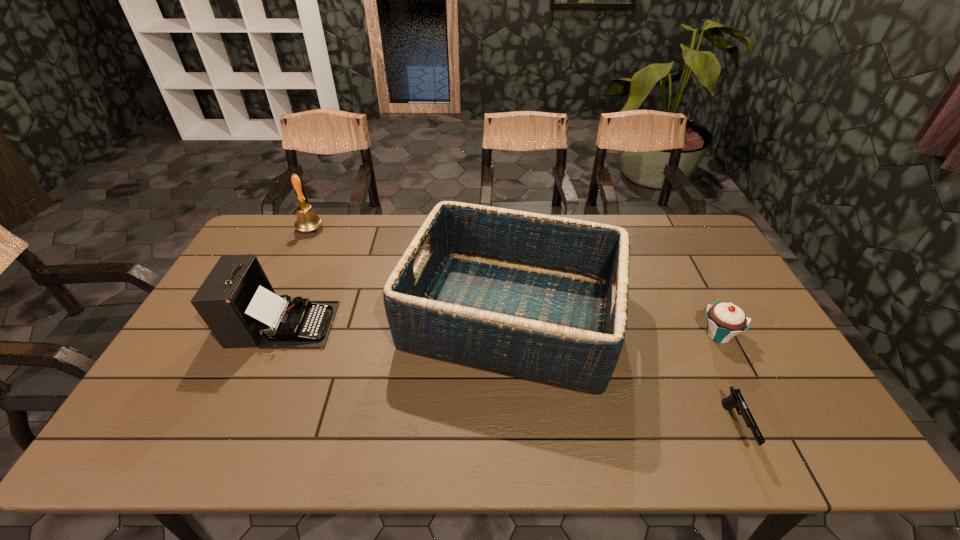
In order to click on vacant space located on the back of the fourth tallest object in this screenshot , I will do `click(693, 287)`.

In order to click on object at the far edge in this screenshot , I will do `click(307, 220)`.

At what (x,y) coordinates should I click in order to perform the action: click on object at the near edge. Please return your answer as a coordinate pair (x, y). Looking at the image, I should click on (735, 400).

Identify the location of bell that is positioned at the left edge. (307, 220).

The width and height of the screenshot is (960, 540). In order to click on typewriter that is at the left edge in this screenshot , I will do `click(237, 302)`.

Where is `object at the right edge`? object at the right edge is located at coordinates (724, 320).

Find the location of a particular element. object situated at the far left corner is located at coordinates (307, 220).

Locate an element on the screen. The height and width of the screenshot is (540, 960). vacant area at the far edge is located at coordinates (316, 247).

In the image, there is a desktop. In order to click on vacant space at the near edge in this screenshot , I will do `click(358, 452)`.

This screenshot has height=540, width=960. In the image, there is a desktop. In order to click on blank space at the left edge in this screenshot , I will do `click(182, 394)`.